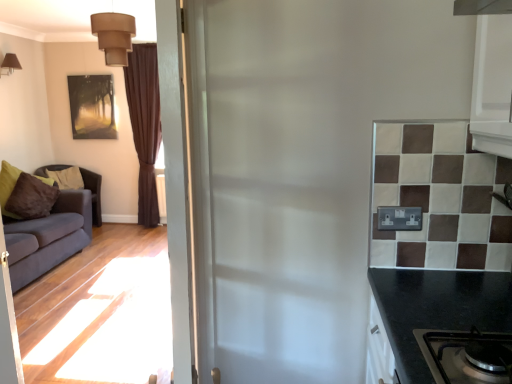
What is the approximate width of matte brown fabric couch at left, placed as the first studio couch when sorted from back to front?

It is 22.13 inches.

Image resolution: width=512 pixels, height=384 pixels. Describe the element at coordinates (93, 193) in the screenshot. I see `matte brown fabric couch at left, placed as the first studio couch when sorted from back to front` at that location.

Find the location of a particular element. brown velvet curtain at left is located at coordinates (145, 125).

Does matte brown wall light at upper left, positioned as the second lamp in front-to-back order, have a greater height compared to white glossy door at center?

In fact, matte brown wall light at upper left, positioned as the second lamp in front-to-back order, may be shorter than white glossy door at center.

Is matte brown wall light at upper left, the 1th lamp from the back, positioned in front of white glossy door at center?

No, matte brown wall light at upper left, the 1th lamp from the back, is further to the viewer.

Which of these two, matte brown wall light at upper left, positioned as the second lamp in front-to-back order, or white glossy door at center, is smaller?

With smaller size is matte brown wall light at upper left, positioned as the second lamp in front-to-back order.

Is white glossy door at center positioned with its back to matte brown lampshade at upper left, which ranks as the 2th lamp in left-to-right order?

No, matte brown lampshade at upper left, which ranks as the 2th lamp in left-to-right order, is not at the back of white glossy door at center.

Considering the positions of objects white glossy door at center and matte brown lampshade at upper left, which ranks as the 2th lamp in left-to-right order, in the image provided, who is behind, white glossy door at center or matte brown lampshade at upper left, which ranks as the 2th lamp in left-to-right order,?

matte brown lampshade at upper left, which ranks as the 2th lamp in left-to-right order, is behind.

From a real-world perspective, which is physically below, white glossy door at center or matte brown lampshade at upper left, acting as the second lamp starting from the back?

From a 3D spatial view, white glossy door at center is below.

Is white glossy door at center next to matte brown lampshade at upper left, acting as the first lamp starting from the front, and touching it?

They are not placed beside each other.

Is matte brown fabric couch at left, placed as the first studio couch when sorted from back to front, not inside matte brown wall light at upper left, positioned as the second lamp in front-to-back order?

Yes, matte brown fabric couch at left, placed as the first studio couch when sorted from back to front, is not within matte brown wall light at upper left, positioned as the second lamp in front-to-back order.

From the image's perspective, is matte brown fabric couch at left, the second studio couch when ordered from front to back, under matte brown wall light at upper left, marked as the second lamp in a right-to-left arrangement?

Yes, from the image's perspective, matte brown fabric couch at left, the second studio couch when ordered from front to back, is below matte brown wall light at upper left, marked as the second lamp in a right-to-left arrangement.

Considering the relative positions of matte brown fabric couch at left, the second studio couch when ordered from front to back, and matte brown wall light at upper left, the 1th lamp in the left-to-right sequence, in the image provided, is matte brown fabric couch at left, the second studio couch when ordered from front to back, in front of matte brown wall light at upper left, the 1th lamp in the left-to-right sequence,?

No, matte brown fabric couch at left, the second studio couch when ordered from front to back, is further to the viewer.

Based on the photo, from a real-world perspective, is matte brown fabric couch at left, the second studio couch when ordered from front to back, positioned above or below matte brown wall light at upper left, the 1th lamp in the left-to-right sequence?

matte brown fabric couch at left, the second studio couch when ordered from front to back, is situated lower than matte brown wall light at upper left, the 1th lamp in the left-to-right sequence, in the real world.

From a real-world perspective, which is physically below, matte gold picture frame at upper left or brown velvet curtain at left?

In real-world perspective, brown velvet curtain at left is lower.

Which is further, (109, 85) or (155, 59)?

The point (109, 85) is farther.

From the image's perspective, is matte gold picture frame at upper left positioned above or below brown velvet curtain at left?

matte gold picture frame at upper left is situated higher than brown velvet curtain at left in the image.

Which of these two, matte gold picture frame at upper left or brown velvet curtain at left, is wider?

brown velvet curtain at left is wider.

Between matte gold picture frame at upper left and matte brown wall light at upper left, the 1th lamp in the left-to-right sequence, which one is positioned behind?

matte gold picture frame at upper left is behind.

Does matte gold picture frame at upper left have a larger size compared to matte brown wall light at upper left, the 1th lamp in the left-to-right sequence?

Correct, matte gold picture frame at upper left is larger in size than matte brown wall light at upper left, the 1th lamp in the left-to-right sequence.

From a real-world perspective, which object rests below the other?

In real-world perspective, matte gold picture frame at upper left is lower.

In the image, is matte gold picture frame at upper left on the left side or the right side of matte brown wall light at upper left, positioned as the second lamp in front-to-back order?

matte gold picture frame at upper left is positioned on matte brown wall light at upper left, positioned as the second lamp in front-to-back order,'s right side.

Locate an element on the screen. curtain behind the matte brown wall light at upper left, the 1th lamp from the back is located at coordinates (145, 125).

Which of these two, matte brown wall light at upper left, the 1th lamp in the left-to-right sequence, or brown velvet curtain at left, stands shorter?

matte brown wall light at upper left, the 1th lamp in the left-to-right sequence, is shorter.

How distant is matte brown wall light at upper left, the 1th lamp in the left-to-right sequence, from brown velvet curtain at left?

matte brown wall light at upper left, the 1th lamp in the left-to-right sequence, and brown velvet curtain at left are 1.63 meters apart.

Considering the sizes of objects matte brown wall light at upper left, the 1th lamp from the back, and brown velvet curtain at left in the image provided, who is thinner, matte brown wall light at upper left, the 1th lamp from the back, or brown velvet curtain at left?

brown velvet curtain at left is thinner.

In terms of height, does matte brown lampshade at upper left, acting as the second lamp starting from the back, look taller or shorter compared to matte gold picture frame at upper left?

Clearly, matte brown lampshade at upper left, acting as the second lamp starting from the back, is shorter compared to matte gold picture frame at upper left.

The height and width of the screenshot is (384, 512). In order to click on picture frame behind the matte brown lampshade at upper left, acting as the second lamp starting from the back in this screenshot , I will do `click(92, 106)`.

Considering the relative sizes of matte brown lampshade at upper left, acting as the second lamp starting from the back, and matte gold picture frame at upper left in the image provided, is matte brown lampshade at upper left, acting as the second lamp starting from the back, thinner than matte gold picture frame at upper left?

No, matte brown lampshade at upper left, acting as the second lamp starting from the back, is not thinner than matte gold picture frame at upper left.

Who is bigger, matte brown lampshade at upper left, acting as the second lamp starting from the back, or matte gold picture frame at upper left?

With larger size is matte brown lampshade at upper left, acting as the second lamp starting from the back.

Find the location of a particular element. the 2nd lamp behind the white glossy door at center is located at coordinates (9, 65).

Image resolution: width=512 pixels, height=384 pixels. I want to click on door to the right of matte brown lampshade at upper left, acting as the first lamp starting from the front, so click(x=177, y=185).

Considering their positions, is velvet blue couch at left, which appears as the first studio couch when viewed from the front, positioned further to matte brown lampshade at upper left, acting as the second lamp starting from the back, than matte brown wall light at upper left, positioned as the second lamp in front-to-back order?

matte brown wall light at upper left, positioned as the second lamp in front-to-back order, is positioned further to the anchor matte brown lampshade at upper left, acting as the second lamp starting from the back.

Estimate the real-world distances between objects in this image. Which object is further from white glossy door at center, matte gold picture frame at upper left or matte brown wall light at upper left, the 1th lamp in the left-to-right sequence?

The object further to white glossy door at center is matte gold picture frame at upper left.

Looking at the image, which one is located further to matte brown wall light at upper left, marked as the second lamp in a right-to-left arrangement, brown velvet curtain at left or matte gold picture frame at upper left?

brown velvet curtain at left is positioned further to the anchor matte brown wall light at upper left, marked as the second lamp in a right-to-left arrangement.

Looking at the image, which one is located further to brown velvet curtain at left, white glossy door at center or matte gold picture frame at upper left?

white glossy door at center lies further to brown velvet curtain at left than the other object.

From the image, which object appears to be nearer to matte brown fabric couch at left, the second studio couch when ordered from front to back, white glossy door at center or brown velvet curtain at left?

The object closer to matte brown fabric couch at left, the second studio couch when ordered from front to back, is brown velvet curtain at left.

Which object lies nearer to the anchor point velvet blue couch at left, marked as the second studio couch in a back-to-front arrangement, matte gold picture frame at upper left or matte brown lampshade at upper left, acting as the first lamp starting from the front?

matte gold picture frame at upper left.

Considering their positions, is brown velvet curtain at left positioned further to matte brown wall light at upper left, positioned as the second lamp in front-to-back order, than velvet blue couch at left, which appears as the first studio couch when viewed from the front?

velvet blue couch at left, which appears as the first studio couch when viewed from the front.

Based on their spatial positions, is matte gold picture frame at upper left or white glossy door at center closer to velvet blue couch at left, which appears as the first studio couch when viewed from the front?

matte gold picture frame at upper left lies closer to velvet blue couch at left, which appears as the first studio couch when viewed from the front, than the other object.

At what (x,y) coordinates should I click in order to perform the action: click on lamp that lies between matte brown wall light at upper left, positioned as the second lamp in front-to-back order, and velvet blue couch at left, which appears as the first studio couch when viewed from the front, from top to bottom. Please return your answer as a coordinate pair (x, y). The width and height of the screenshot is (512, 384). Looking at the image, I should click on (114, 36).

At what (x,y) coordinates should I click in order to perform the action: click on studio couch located between matte brown lampshade at upper left, which ranks as the 2th lamp in left-to-right order, and brown velvet curtain at left in the depth direction. Please return your answer as a coordinate pair (x, y). Looking at the image, I should click on (93, 193).

Where is `curtain between matte gold picture frame at upper left and matte brown fabric couch at left, the second studio couch when ordered from front to back, from top to bottom`? The width and height of the screenshot is (512, 384). curtain between matte gold picture frame at upper left and matte brown fabric couch at left, the second studio couch when ordered from front to back, from top to bottom is located at coordinates (145, 125).

The width and height of the screenshot is (512, 384). Identify the location of curtain between velvet blue couch at left, marked as the second studio couch in a back-to-front arrangement, and matte gold picture frame at upper left, along the z-axis. (145, 125).